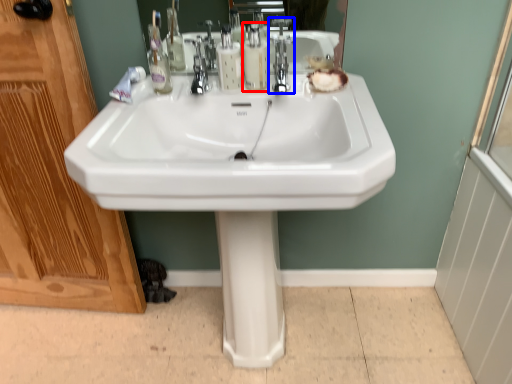
Question: Which object appears farthest to the camera in this image, soap dispenser (highlighted by a red box) or tap (highlighted by a blue box)?

Choices:
 (A) soap dispenser
 (B) tap

Answer: (A)